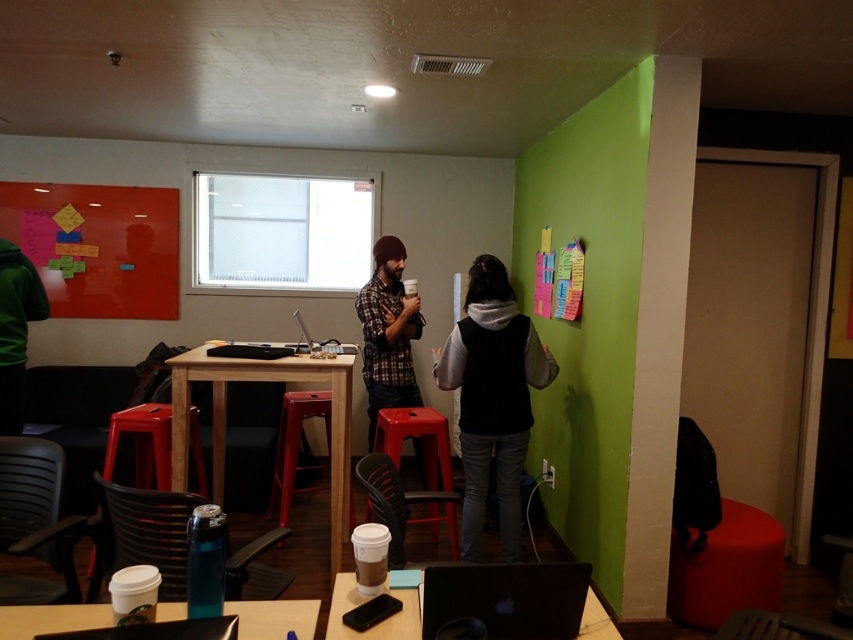
You are standing at the center of the room and want to reach the black glossy laptop at lower center. According to the coordinates provided, in which direction should you move relative to your current position?

The black glossy laptop at lower center is located at coordinates point (508, 598). Since you are at the center of the room, moving towards the lower right direction will lead you to the black glossy laptop at lower center.

You are organizing a small meeting in this workspace and need to place a 30 inch wide presentation board between the matte plastic stool at center and the silver metallic laptop at center. Is there enough space between them to fit the board?

The distance between the matte plastic stool at center and the silver metallic laptop at center is 28.69 inches. Since the presentation board is 30 inches wide, there isn not enough space to fit it between them.

You are sitting at the table in the workspace and want to reach the silver metallic laptop at center without moving the matte plastic stool at center. Is this possible?

The matte plastic stool at center is in front of the silver metallic laptop at center, so you cannot reach the silver metallic laptop at center without moving the matte plastic stool at center.